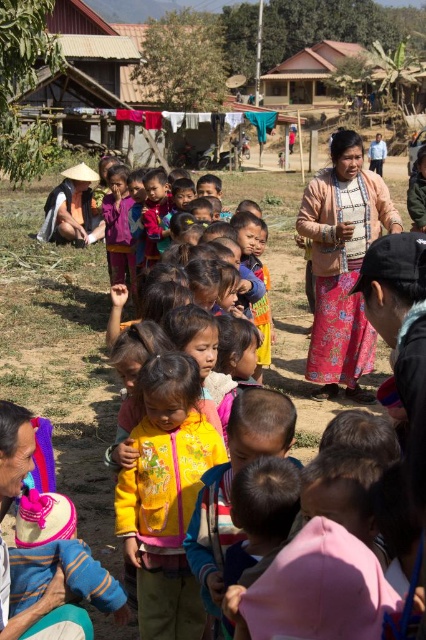
You are standing in the rural village scene and want to take a photo of both the point at (137, 108) and the point at (154, 528). Which point should you focus on first to ensure both are in clear view?

You should focus on the point at (137, 108) first because it is closer to the camera than the point at (154, 528). By focusing on the closer point, the farther point will also be in focus if they are within the depth of field range.

You are standing at the point marked by the coordinates point (x=138, y=68) in the image. What structure would you be standing on?

The point (x=138, y=68) indicates a wooden hut at upper center, so you would be standing on the wooden hut at upper center.